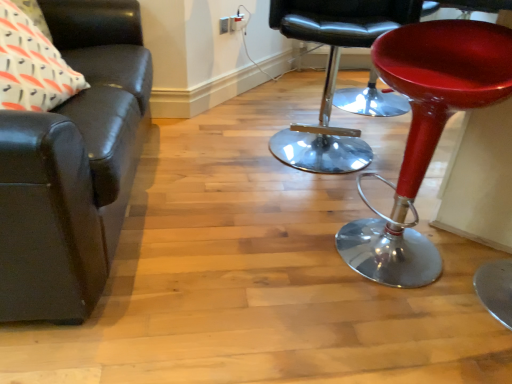
You are a GUI agent. You are given a task and a screenshot of the screen. Output one action in this format:
    pyautogui.click(x=<x>, y=<y>)
    Task: Click on the vacant space to the left of shiny red stool at right
    Image resolution: width=512 pixels, height=384 pixels.
    Given the screenshot: What is the action you would take?
    pyautogui.click(x=239, y=186)